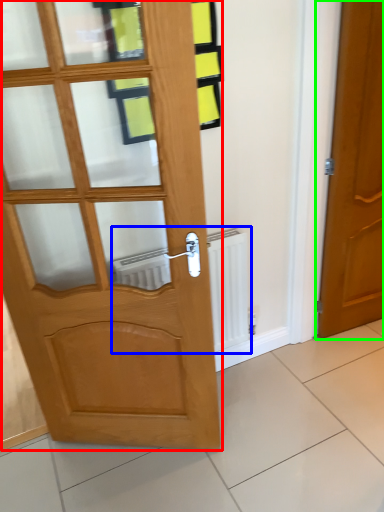
Question: Which object is the farthest from door (highlighted by a red box)? Choose among these: radiator (highlighted by a blue box) or door (highlighted by a green box).

Choices:
 (A) radiator
 (B) door

Answer: (B)